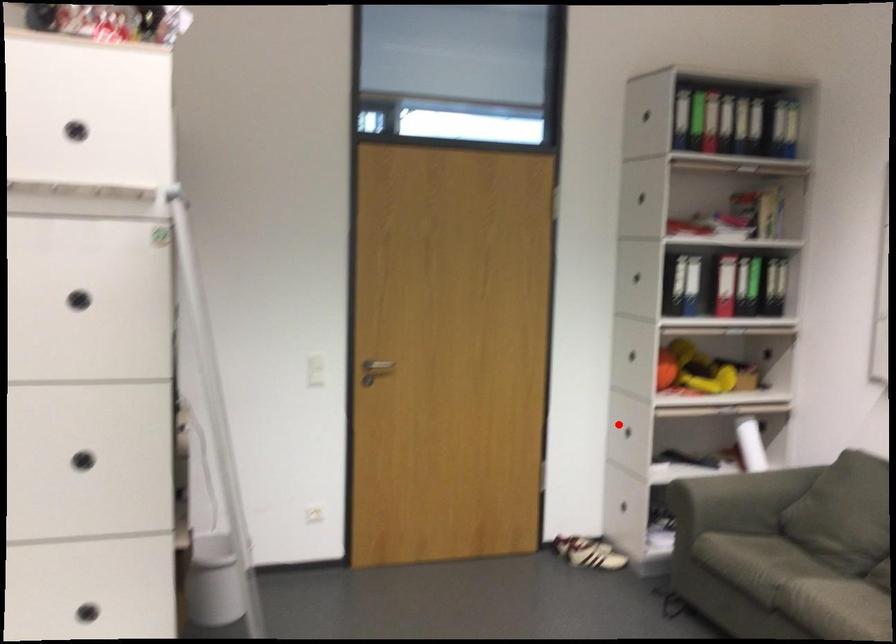
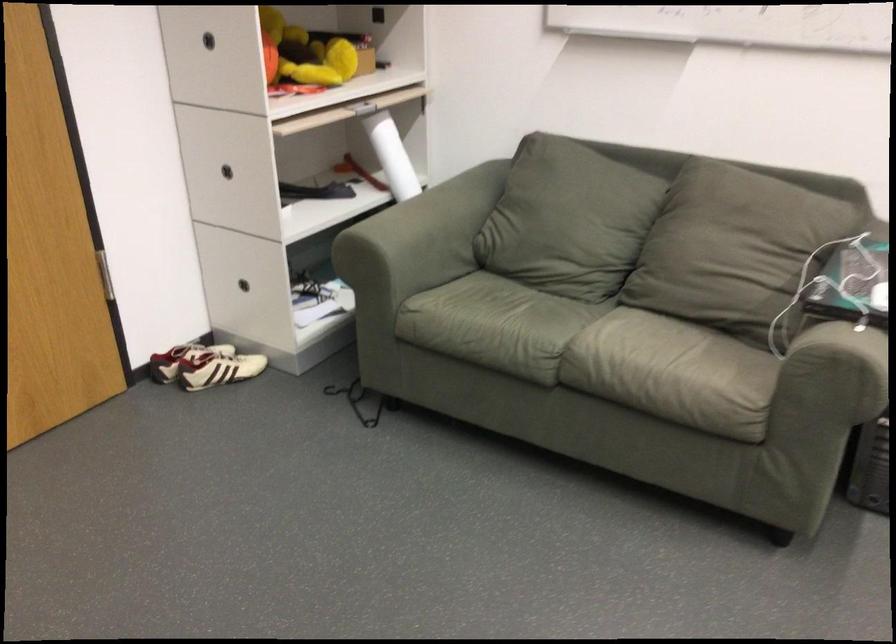
Question: A red point is marked in image1. In image2, is the corresponding 3D point closer to the camera or farther? Reply with the corresponding letter.

Choices:
 (A) The corresponding 3D point is closer.
 (B) The corresponding 3D point is farther.

Answer: (A)